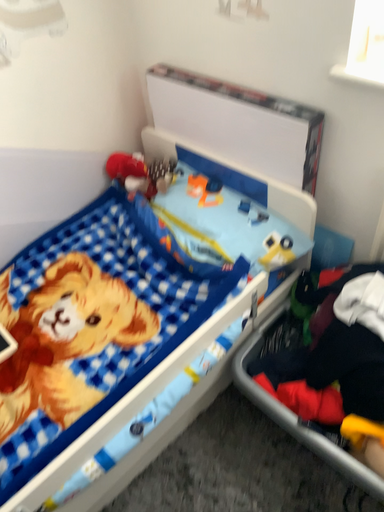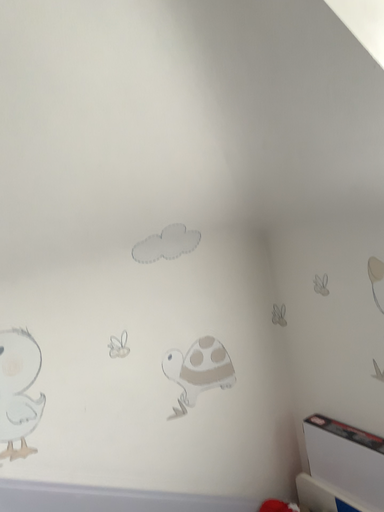
Question: Which way did the camera rotate in the video?

Choices:
 (A) rotated upward
 (B) rotated downward

Answer: (A)